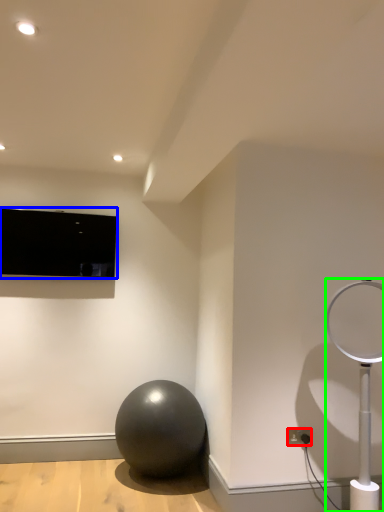
Question: Which is nearer to the electric outlet (highlighted by a red box)? television (highlighted by a blue box) or lamp (highlighted by a green box).

Choices:
 (A) television
 (B) lamp

Answer: (B)